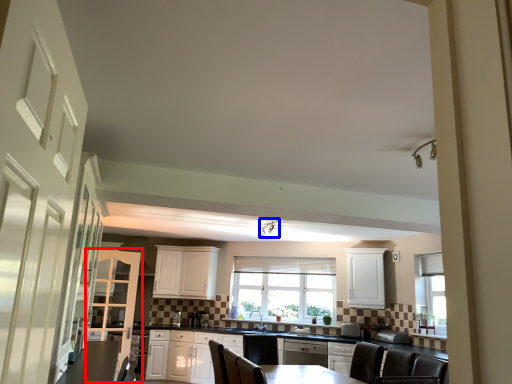
Question: Which object is closer to the camera taking this photo, cabinetry (highlighted by a red box) or light fixture (highlighted by a blue box)?

Choices:
 (A) cabinetry
 (B) light fixture

Answer: (B)